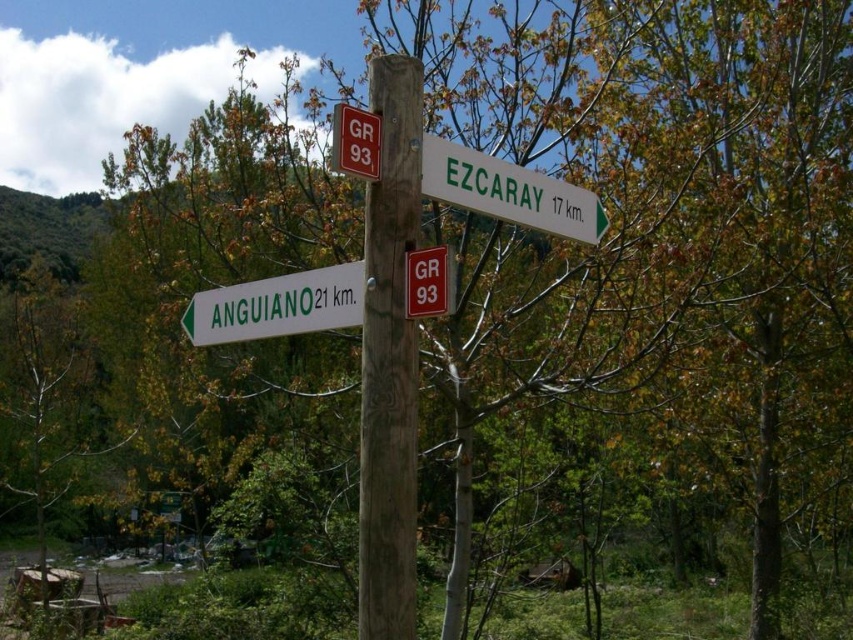
Looking at this image, measure the distance between wooden post at center and camera.

wooden post at center is 11.93 feet away from camera.

Based on the photo, is the position of wooden post at center more distant than that of white plastic sign at lower left?

No, it is not.

Is point (360, 609) closer to camera compared to point (196, 296)?

Yes, point (360, 609) is in front of point (196, 296).

Identify the location of wooden post at center. The image size is (853, 640). (389, 358).

Which is behind, point (448, 157) or point (405, 266)?

The point (448, 157) is behind.

Locate an element on the screen. This screenshot has height=640, width=853. green plastic sign at upper center is located at coordinates (508, 192).

Is point (442, 184) behind point (294, 276)?

That is False.

Does green plastic sign at upper center have a larger size compared to white plastic sign at lower left?

No.

Does point (430, 161) lie in front of point (281, 336)?

Yes.

Where is `green plastic sign at upper center`? This screenshot has width=853, height=640. green plastic sign at upper center is located at coordinates (508, 192).